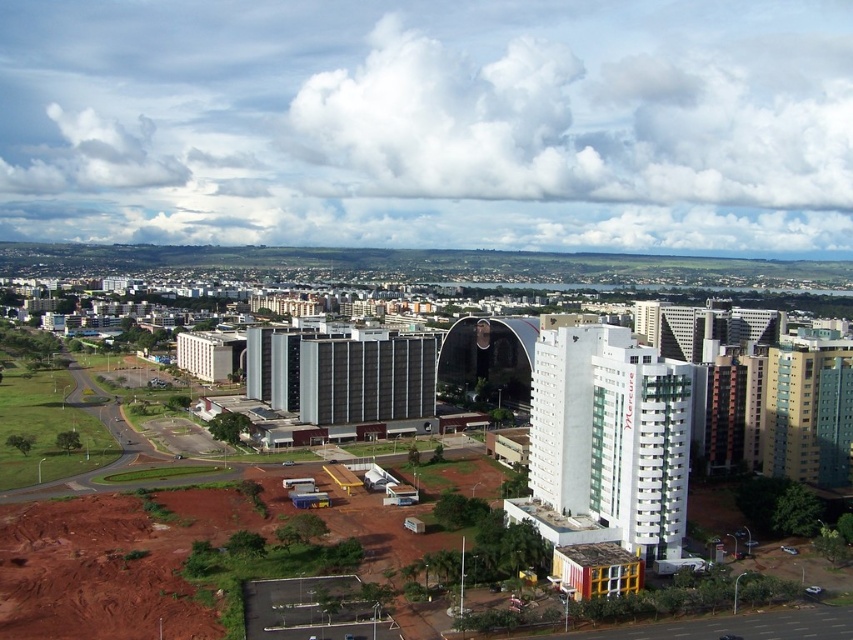
You are standing at the point with coordinates 0.5, 0.5 in the image. You want to walk towards the white smooth building at center. In which direction should you move?

The white smooth building at center is located at point [611,435]. Since your current position is at [426,320], you should move northeast to reach it.

You are navigating a drone over an urban landscape. Your mission is to deliver a package to the white smooth building at center. According to the coordinates provided, where exactly should you direct the drone to land?

The white smooth building at center is located at point (611, 435), so direct the drone to land there.